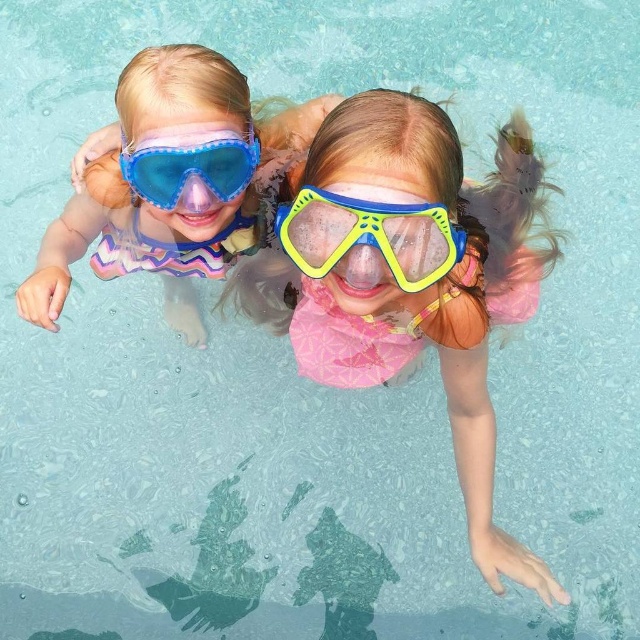
You are a photographer trying to capture a clear shot of both the blue rubber swimming mask at center and the transparent plastic goggles at upper center. Since you want to focus on the mask, where should you aim your camera to ensure it is in the foreground?

The blue rubber swimming mask at center is located below the transparent plastic goggles at upper center, so aiming the camera towards the lower part of the frame where the mask is positioned will place it in the foreground.

You are standing at the edge of the pool and want to take a photo of the point at coordinates point (316, 148). If your camera has a maximum focus range of 1.5 meters, will it be able to focus on that point?

The point (316, 148) is 1.38 meters away from the camera, which is within the camera maximum focus range of 1.5 meters. Therefore, the camera can focus on the point (316, 148).